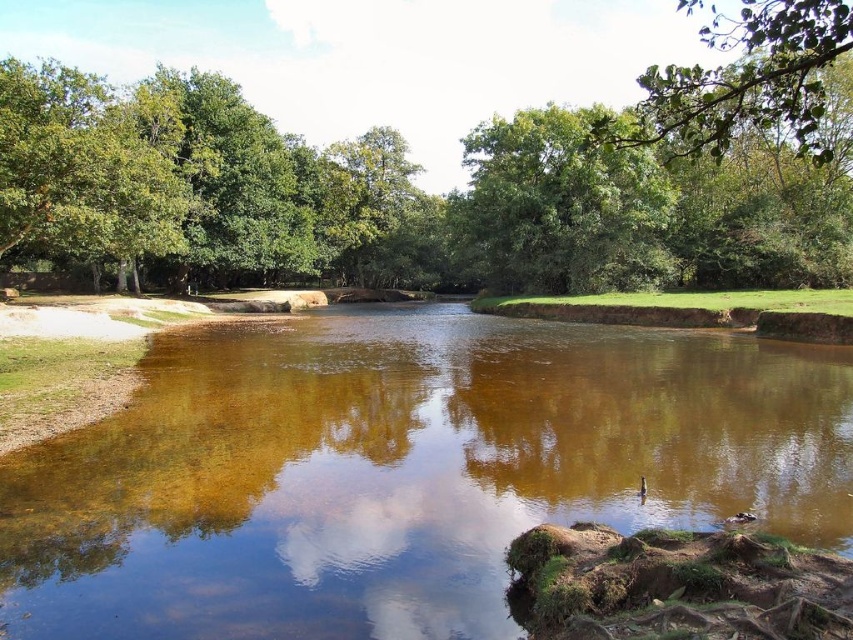
You are a bird looking for a place to perch. You see the green leafy tree at upper center and the green leafy branch at upper right. Which one has more space for you to land comfortably?

The green leafy branch at upper right has more space for you to land comfortably because it occupies more space than the green leafy tree at upper center.

Based on the photo, you are standing at the point with coordinates point (144, 586) and want to walk towards the point (825, 106). Based on the scene description, will you be walking towards the river or away from it?

Based on the scene description, you are walking towards the point (825, 106) which is behind point (144, 586), so you are moving away from the river.